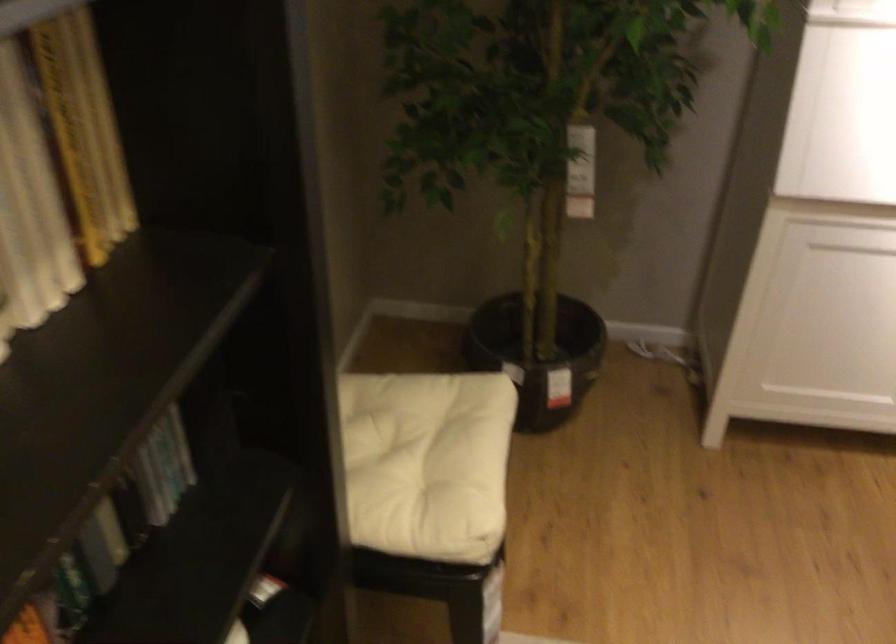
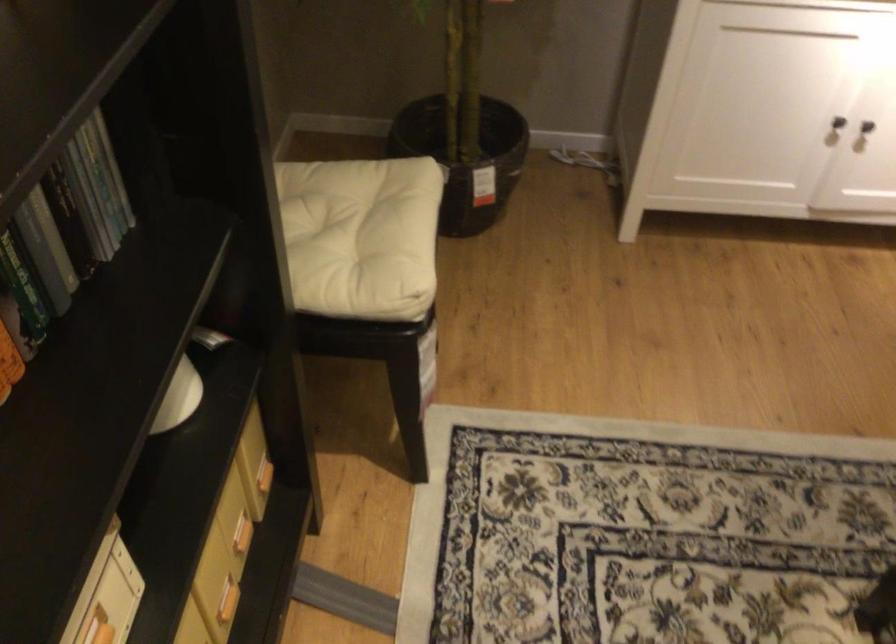
Question: The images are taken continuously from a first-person perspective. In which direction is your viewpoint rotating?

Choices:
 (A) Left
 (B) Right
 (C) Up
 (D) Down

Answer: (D)